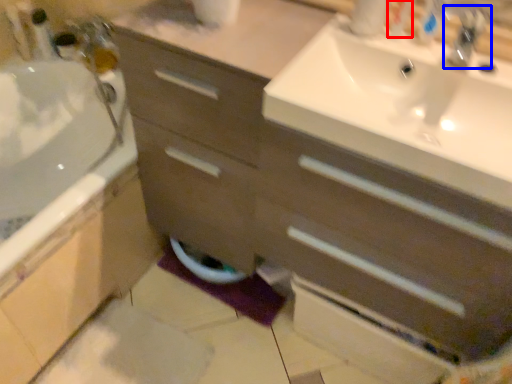
Question: Which object appears farthest to the camera in this image, toiletry (highlighted by a red box) or tap (highlighted by a blue box)?

Choices:
 (A) toiletry
 (B) tap

Answer: (A)